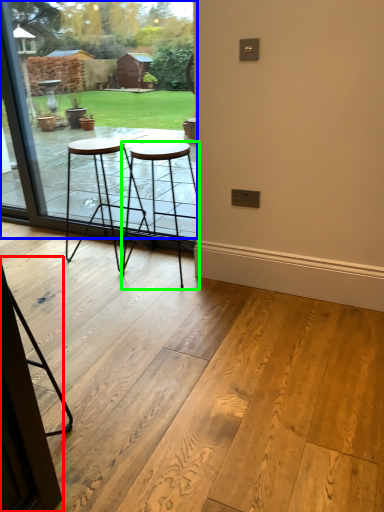
Question: Which object is the farthest from screen door (highlighted by a red box)? Choose among these: window (highlighted by a blue box) or stool (highlighted by a green box).

Choices:
 (A) window
 (B) stool

Answer: (A)